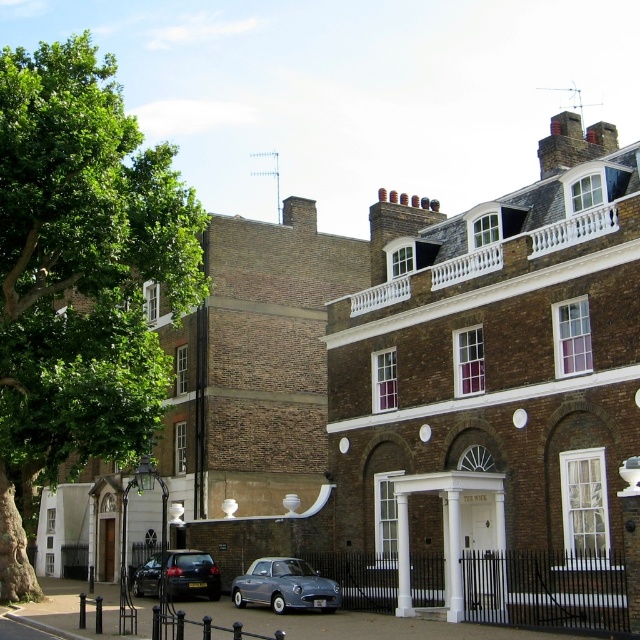
You are standing in front of the historic building and want to take a photo that includes both the green leafy tree at left and the matte black car at center. Which object should you position closer to the front of your camera frame to ensure both are in focus?

To ensure both the green leafy tree at left and the matte black car at center are in focus, position the green leafy tree at left closer to the front of your camera frame since it is closer to the viewer than the matte black car at center.